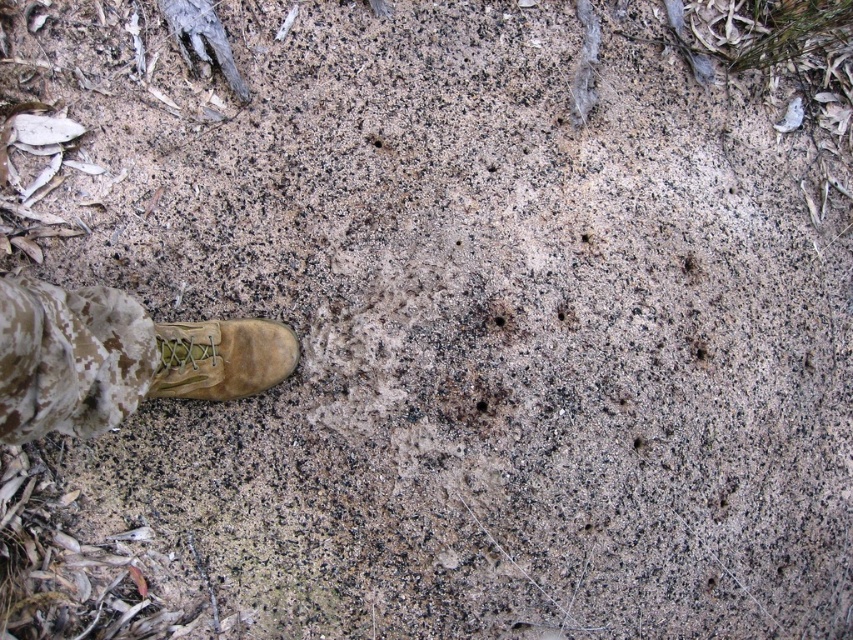
Question: Is camouflage fabric at lower left positioned behind tan suede boot at lower left?

Choices:
 (A) no
 (B) yes

Answer: (A)

Question: Does camouflage fabric at lower left appear on the right side of tan suede boot at lower left?

Choices:
 (A) yes
 (B) no

Answer: (B)

Question: Which point is closer to the camera?

Choices:
 (A) (108, 371)
 (B) (250, 365)

Answer: (A)

Question: Does camouflage fabric at lower left appear over tan suede boot at lower left?

Choices:
 (A) yes
 (B) no

Answer: (A)

Question: Which object is closer to the camera taking this photo?

Choices:
 (A) tan suede boot at lower left
 (B) camouflage fabric at lower left

Answer: (B)